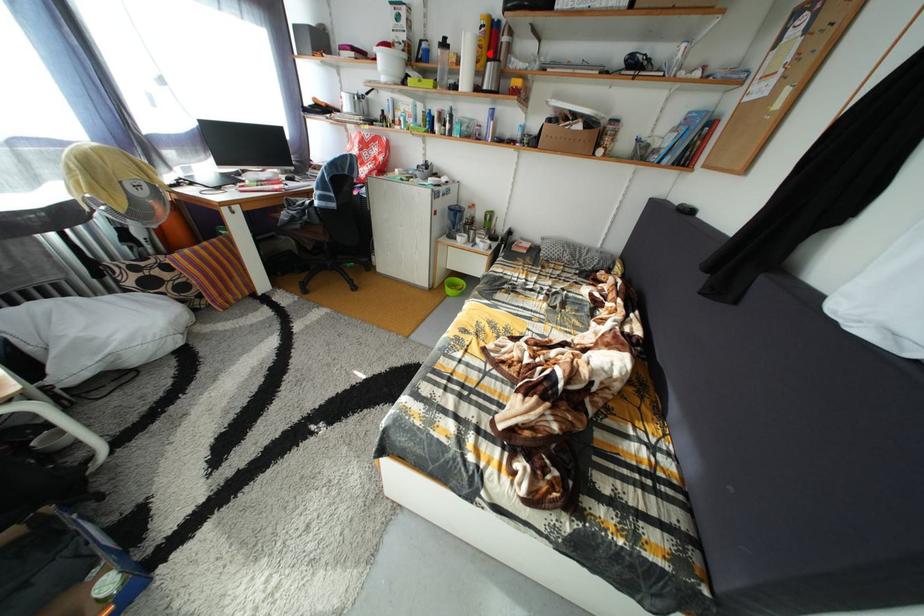
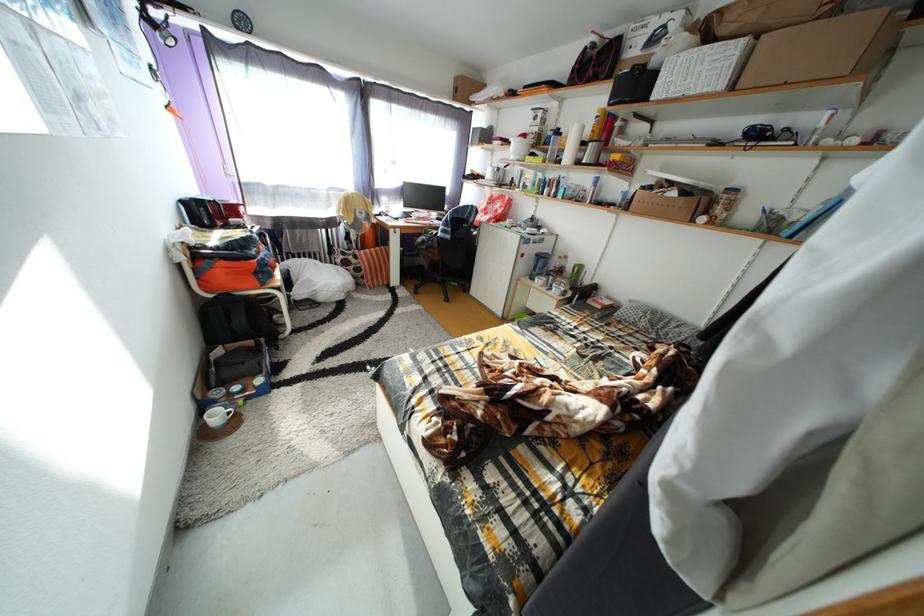
In the second image, find the point that corresponds to the highlighted location in the first image.

(602, 138)